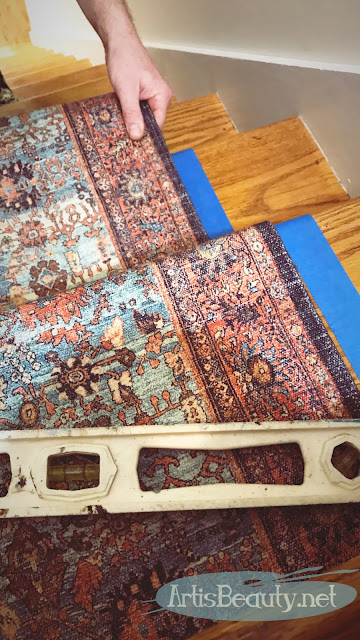
Locate an element on the screen. This screenshot has width=360, height=640. dark line on rug border is located at coordinates (307, 306), (169, 164).